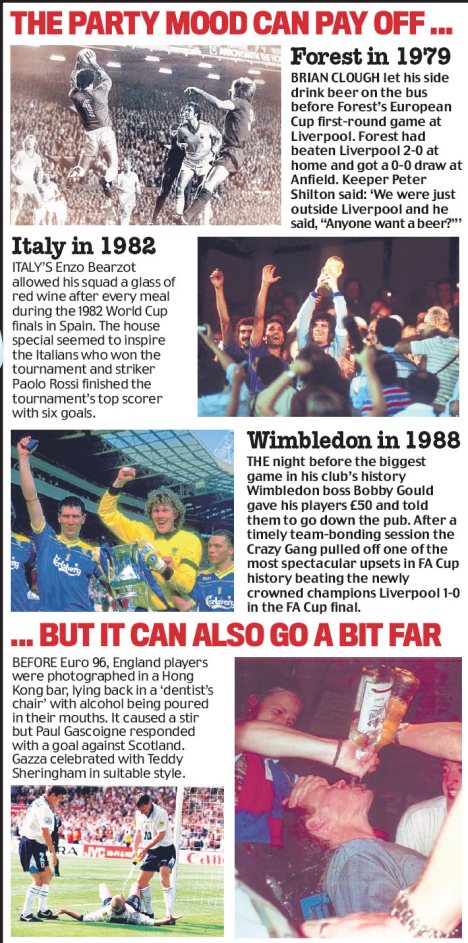
Where is `trophy`? This screenshot has width=468, height=943. trophy is located at coordinates (329, 266).